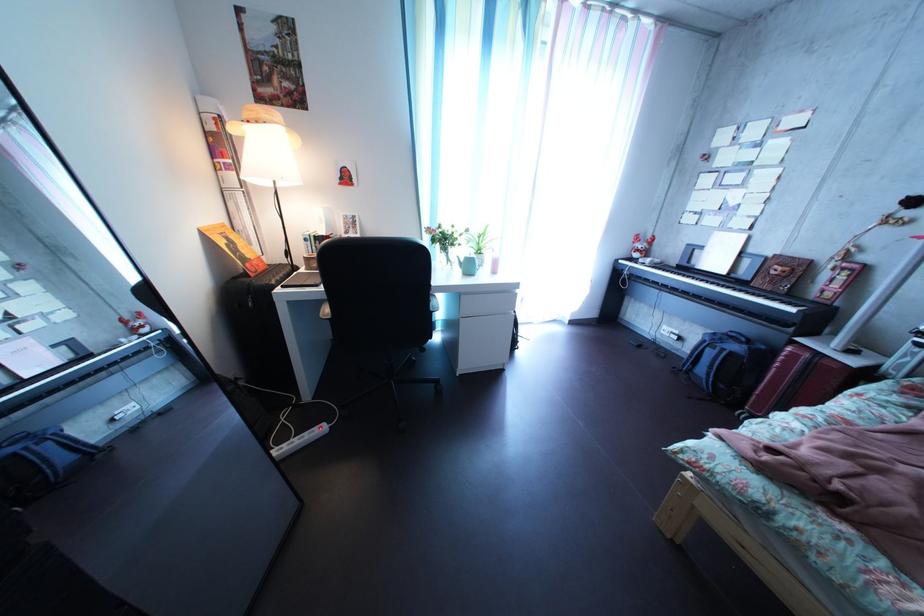
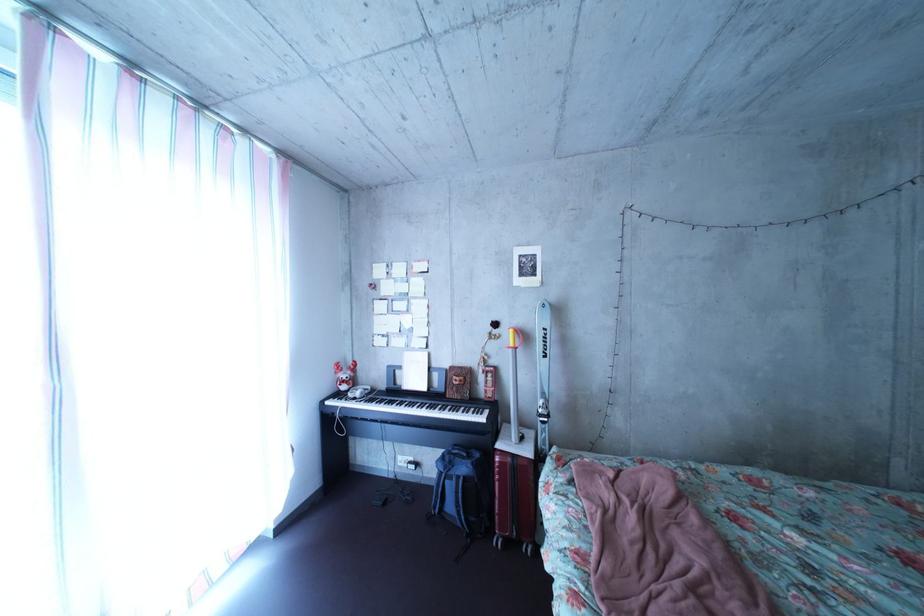
Where in the second image is the point corresponding to point 650,264 from the first image?

(358, 395)